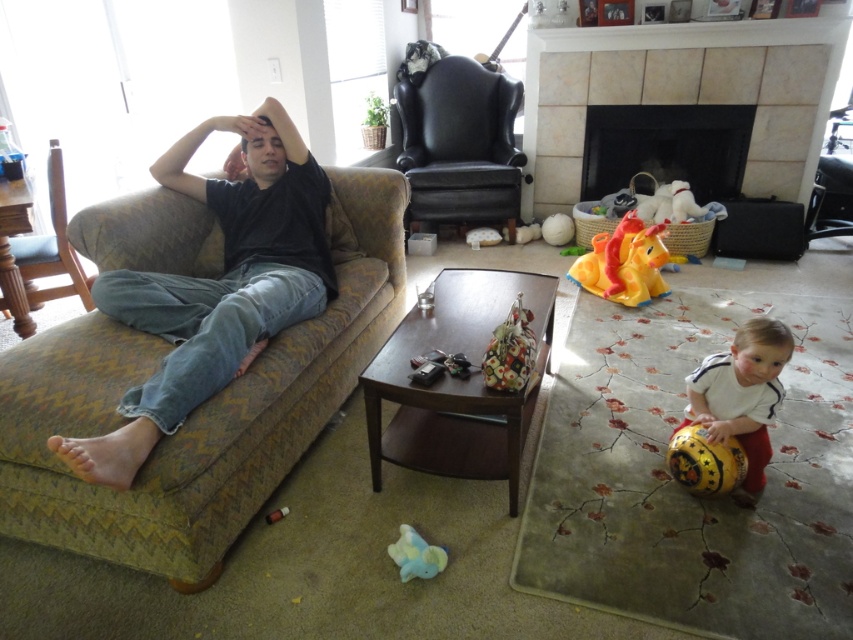
Question: Which object is farther from the camera taking this photo?

Choices:
 (A) black leather armchair at center
 (B) black tile fireplace at center

Answer: (A)

Question: Does black leather armchair at center have a greater width compared to white matte toddler at lower right?

Choices:
 (A) no
 (B) yes

Answer: (B)

Question: Which of the following is the closest to the observer?

Choices:
 (A) brown leather armchair at left
 (B) white marble fireplace at upper center

Answer: (A)

Question: Is rubberized yellow horse at center positioned at the back of skinny barefoot at lower left?

Choices:
 (A) yes
 (B) no

Answer: (A)

Question: Can you confirm if smooth skin head at lower right is positioned above blue rubber duck at lower center?

Choices:
 (A) no
 (B) yes

Answer: (B)

Question: Which of the following is the farthest from the observer?

Choices:
 (A) blue rubber duck at lower center
 (B) green zigzag fabric couch at left
 (C) black tile fireplace at center
 (D) rubberized yellow horse at center

Answer: (C)